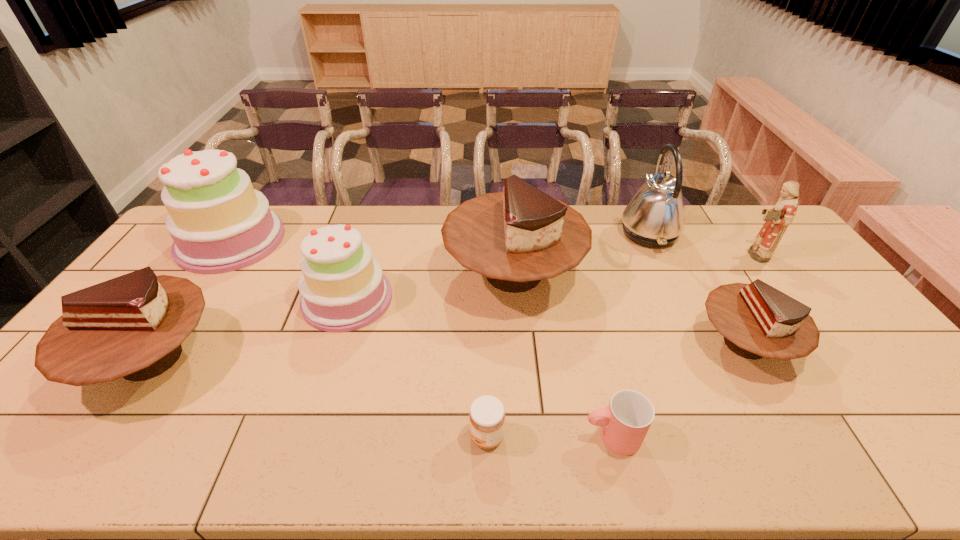
Find the location of a particular element. The image size is (960, 540). free location located on the left of the third object from left to right is located at coordinates (283, 299).

Where is `vacant space located on the back of the leftmost red cake`? The height and width of the screenshot is (540, 960). vacant space located on the back of the leftmost red cake is located at coordinates (206, 278).

Identify the location of vacant space located 0.060m on the left of the smallest red cake. 674,343.

Identify the location of vacant space situated on the side of the cup with the handle. (535, 436).

You are a GUI agent. You are given a task and a screenshot of the screen. Output one action in this format:
    pyautogui.click(x=<x>, y=<y>)
    Task: Click on the blank space located on the side of the cup with the handle
    The height and width of the screenshot is (540, 960).
    Given the screenshot: What is the action you would take?
    pyautogui.click(x=499, y=436)

Locate an element on the screen. Image resolution: width=960 pixels, height=540 pixels. vacant area located on the side of the cup with the handle is located at coordinates (438, 436).

The image size is (960, 540). Identify the location of vacant space located on the front label of the jam. (382, 436).

What are the coordinates of `free space located 0.230m on the front label of the jam` in the screenshot? It's located at (369, 436).

Where is `free region located on the front label of the jam`? The image size is (960, 540). free region located on the front label of the jam is located at coordinates (404, 436).

This screenshot has width=960, height=540. Identify the location of kettle at the far edge. (654, 217).